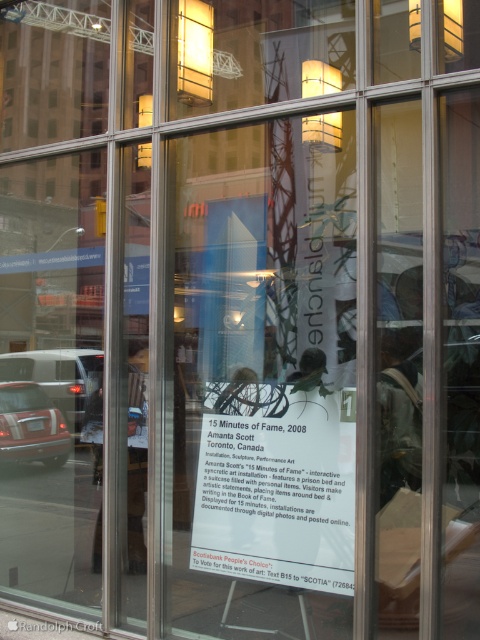
Who is more forward, (145,433) or (61,451)?

Point (145,433) is in front.

Between point (129, 394) and point (19, 440), which one is positioned behind?

Point (19, 440)

Identify the location of matte black car at left. Image resolution: width=480 pixels, height=640 pixels. (62, 381).

Which is below, white paper at center or matte black car at left?

matte black car at left is lower down.

Does point (300, 554) come behind point (63, 385)?

No, (300, 554) is closer to viewer.

Between point (284, 506) and point (84, 362), which one is positioned behind?

Point (84, 362)

The width and height of the screenshot is (480, 640). What are the coordinates of `white paper at center` in the screenshot? It's located at (276, 484).

This screenshot has height=640, width=480. Describe the element at coordinates (276, 484) in the screenshot. I see `white paper at center` at that location.

Does white paper at center have a lesser width compared to matte black car at lower left?

Yes, white paper at center is thinner than matte black car at lower left.

Who is more distant from viewer, (267, 392) or (6, 435)?

The point (6, 435) is more distant.

At what (x,y) coordinates should I click in order to perform the action: click on white paper at center. Please return your answer as a coordinate pair (x, y). Looking at the image, I should click on pos(276,484).